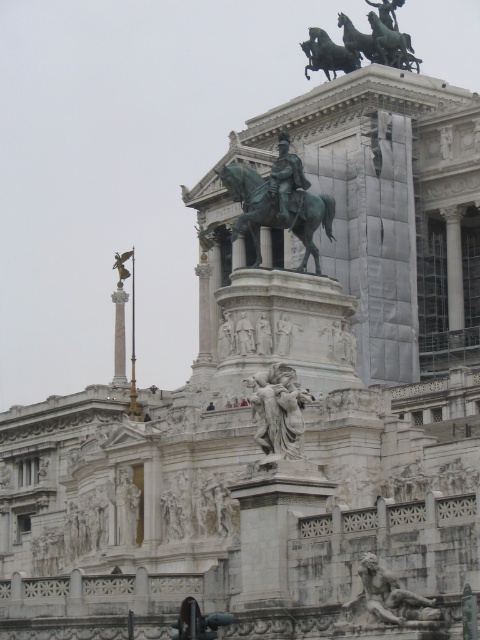
You are standing in front of the grand monument and notice two points marked on the pedestal. The first point is at coordinate point(301, 404) and the second at point(285, 168). From your perspective, which point is closer to you?

Point(301, 404) is in front of point(285, 168), so it is closer to you.